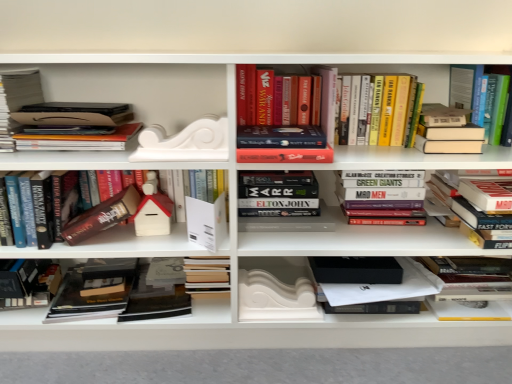
Where is `blank space situated above hardcover book at center, which appears as the 3th paperback book when viewed from the left (from a real-world perspective)`? Image resolution: width=512 pixels, height=384 pixels. blank space situated above hardcover book at center, which appears as the 3th paperback book when viewed from the left (from a real-world perspective) is located at coordinates (156, 280).